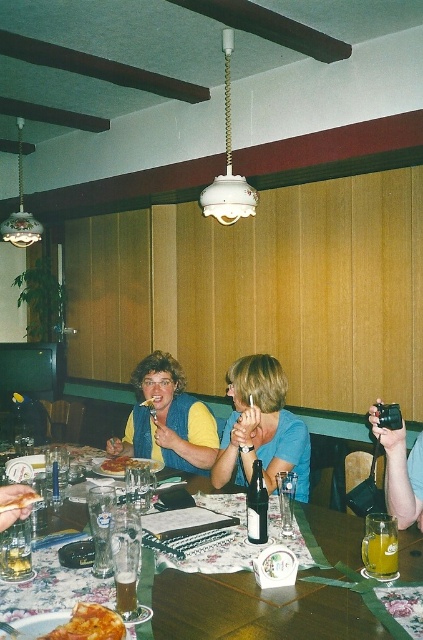
Question: Is wooden table at center behind blue denim vest at center?

Choices:
 (A) yes
 (B) no

Answer: (B)

Question: Is wooden table at center to the left of yellowish matte pizza slice at lower left from the viewer's perspective?

Choices:
 (A) yes
 (B) no

Answer: (B)

Question: Is translucent glass beer at table center positioned in front of yellowish matte pizza slice at lower left?

Choices:
 (A) no
 (B) yes

Answer: (A)

Question: Estimate the real-world distances between objects in this image. Which object is farther from the translucent glass at table center?

Choices:
 (A) translucent glass mug at table center
 (B) yellowish matte pizza slice at lower left

Answer: (A)

Question: Which object is positioned farthest from the golden crispy pizza at center?

Choices:
 (A) green glass bottle at center
 (B) blue fabric shirt at center

Answer: (A)

Question: Considering the real-world distances, which object is closest to the golden crispy pizza at center?

Choices:
 (A) blue fabric shirt at center
 (B) translucent glass beer at table center

Answer: (A)